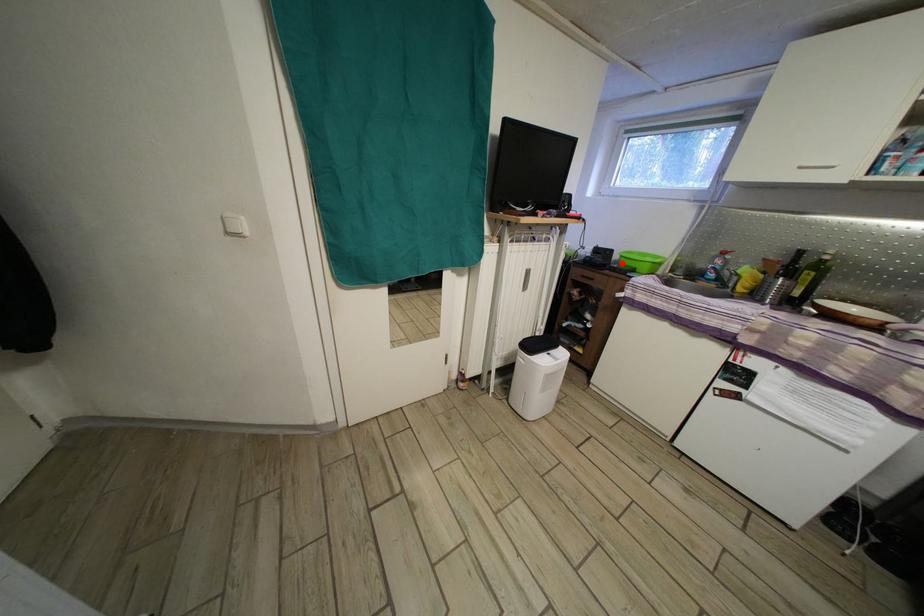
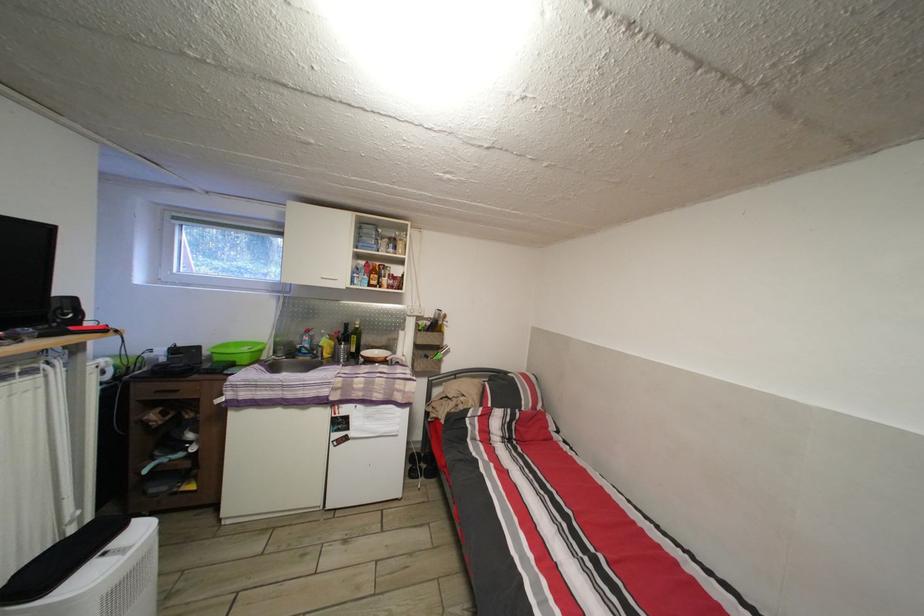
Locate, in the second image, the point that corresponds to the highlighted location in the first image.

(213, 359)